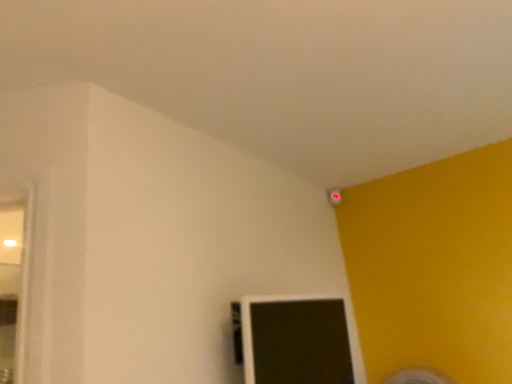
Measure the distance between point (326,307) and camera.

A distance of 1.66 meters exists between point (326,307) and camera.

The image size is (512, 384). I want to click on matte black monitor at lower center, so click(x=300, y=340).

Describe the element at coordinates (300, 340) in the screenshot. This screenshot has width=512, height=384. I see `matte black monitor at lower center` at that location.

The height and width of the screenshot is (384, 512). I want to click on matte black monitor at lower center, so click(300, 340).